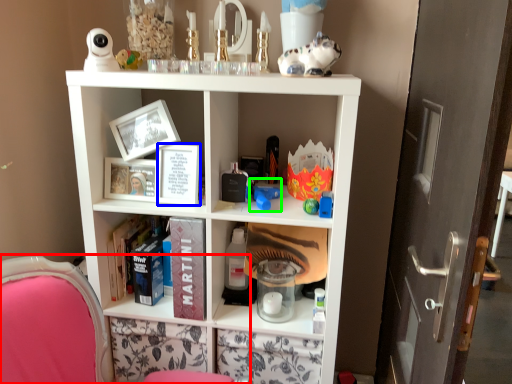
Question: Which is nearer to the swivel chair (highlighted by a red box)? book (highlighted by a blue box) or toy (highlighted by a green box).

Choices:
 (A) book
 (B) toy

Answer: (A)